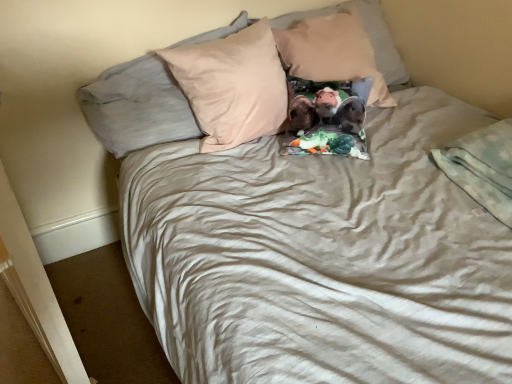
Question: Considering their positions, is fluffy fabric pillow at center, which is the 1th pillow in right-to-left order, located in front of or behind beige cotton pillow at center, which is the second pillow from left to right?

Choices:
 (A) behind
 (B) front

Answer: (A)

Question: Considering the positions of fluffy fabric pillow at center, placed as the 3th pillow when sorted from left to right, and beige cotton pillow at center, arranged as the second pillow when viewed from the right, in the image, is fluffy fabric pillow at center, placed as the 3th pillow when sorted from left to right, taller or shorter than beige cotton pillow at center, arranged as the second pillow when viewed from the right,?

Choices:
 (A) tall
 (B) short

Answer: (B)

Question: Which is nearer to the light gray soft blanket at lower right?

Choices:
 (A) beige cotton pillow at center, which is the second pillow from left to right
 (B) beige fabric pillow at upper center, the 1th pillow positioned from the left
 (C) fluffy fabric pillow at center, which is the 1th pillow in right-to-left order

Answer: (C)

Question: Which is nearer to the beige fabric pillow at upper center, the 1th pillow positioned from the left?

Choices:
 (A) light gray soft blanket at lower right
 (B) fluffy fabric pillow at center, which is the 1th pillow in right-to-left order
 (C) beige cotton pillow at center, which is the second pillow from left to right

Answer: (C)